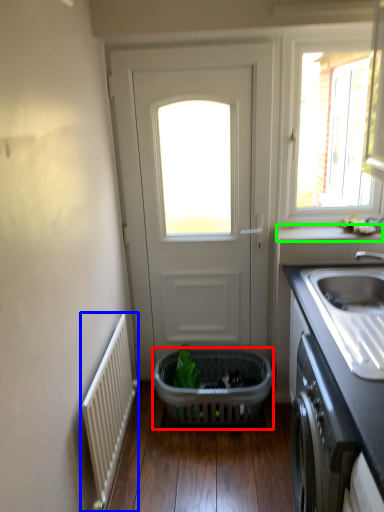
Question: Estimate the real-world distances between objects in this image. Which object is closer to basket (highlighted by a red box), radiator (highlighted by a blue box) or window sill (highlighted by a green box)?

Choices:
 (A) radiator
 (B) window sill

Answer: (A)